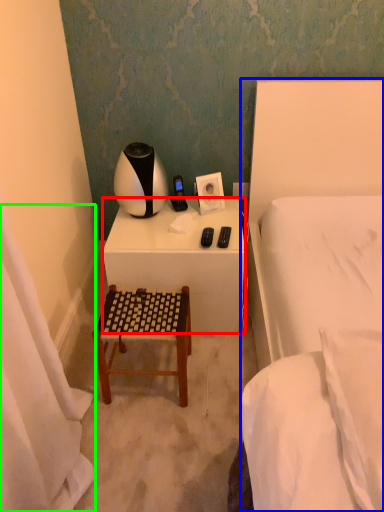
Question: Considering the real-world distances, which object is farthest from desk (highlighted by a red box)? bed (highlighted by a blue box) or curtain (highlighted by a green box)?

Choices:
 (A) bed
 (B) curtain

Answer: (B)